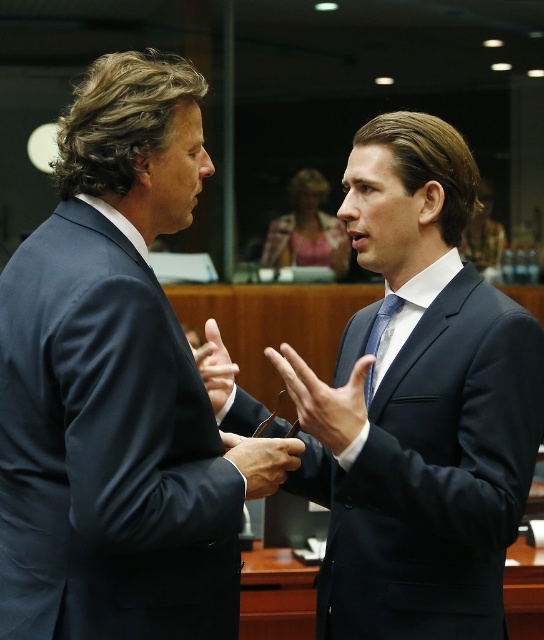
You are a photographer trying to focus on the two points in the image. Which point, point [227,436] or point [214,364], is closer to your camera lens?

Point [227,436] is closer to the camera lens than point [214,364].

You are an observer in the room. You notice the black leather hand at center and the matte blue tie at center. Which object is nearer to you?

The black leather hand at center is closer to the viewer than the matte blue tie at center.

You are an observer in the room. You see the dark blue suit at center and the black leather hand at center. Which object is positioned higher in the image?

The dark blue suit at center is above the black leather hand at center, so the dark blue suit at center is positioned higher in the image.